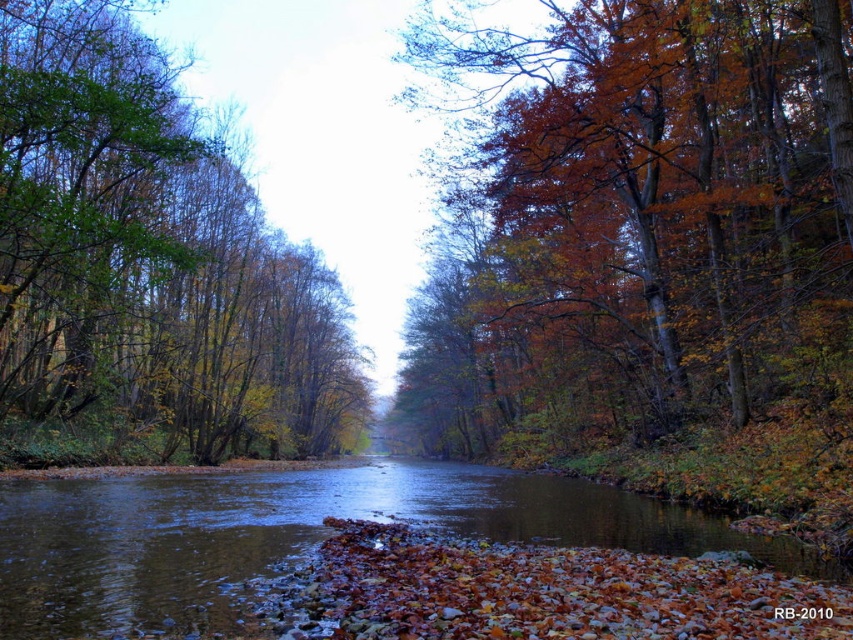
You are a hiker who wants to cross the river using a narrow wooden bridge that is 14 meters long. The bridge is located between the autumn leaves at right and the brown smooth water at center. Can you safely cross the river without getting your feet wet?

The distance between autumn leaves at right and brown smooth water at center is 15.01 meters, which is longer than the 14 meter bridge. Therefore, the bridge is too short to span the river, so you cannot safely cross without getting wet.

You are a hiker standing at the riverbank. You see autumn leaves at right and brown smooth water at center. Which object is higher in the scene?

The autumn leaves at right are taller than the brown smooth water at center.

You are standing on a path that runs parallel to the river and want to take a photo of the green leafy tree at left and the brown smooth water at center. Which object should you focus on first to ensure both are in clear view?

You should focus on the green leafy tree at left first because it is closer to you than the brown smooth water at center, so adjusting focus starting from the closer object ensures both are in clear view.